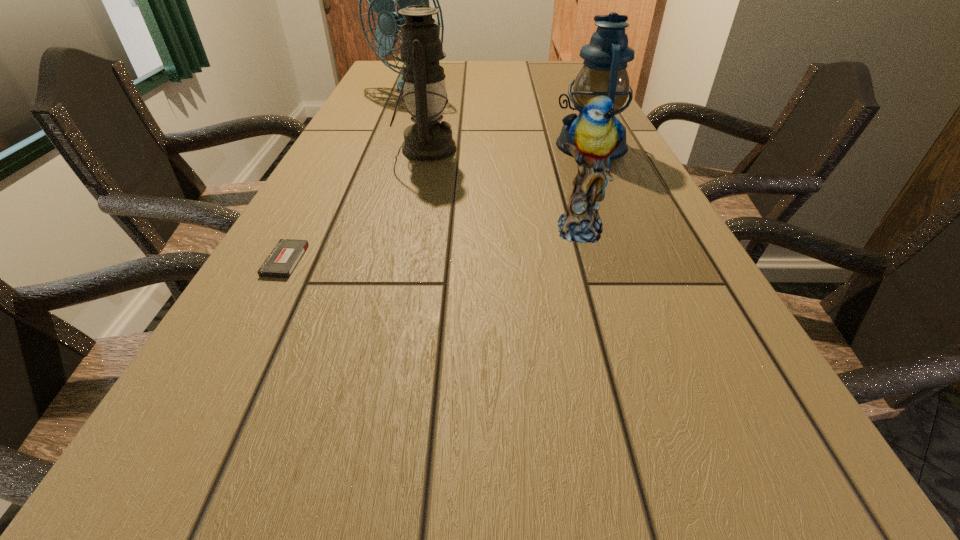
Identify the location of vacant point that satisfies the following two spatial constraints: 1. on the face of the lantern; 2. on the front side of the oil lamp. This screenshot has height=540, width=960. (593, 149).